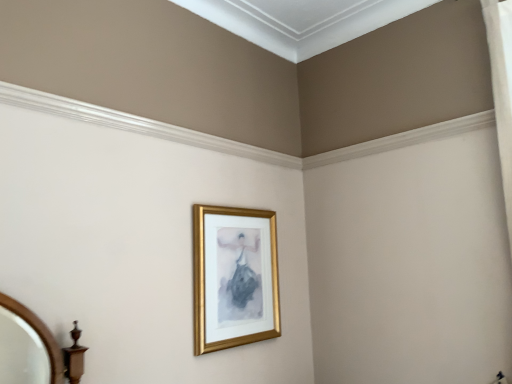
This screenshot has height=384, width=512. What do you see at coordinates (234, 277) in the screenshot? I see `gold metallic picture frame at center` at bounding box center [234, 277].

Image resolution: width=512 pixels, height=384 pixels. I want to click on gold metallic picture frame at center, so (234, 277).

Image resolution: width=512 pixels, height=384 pixels. What are the coordinates of `gold metallic picture frame at center` in the screenshot? It's located at (234, 277).